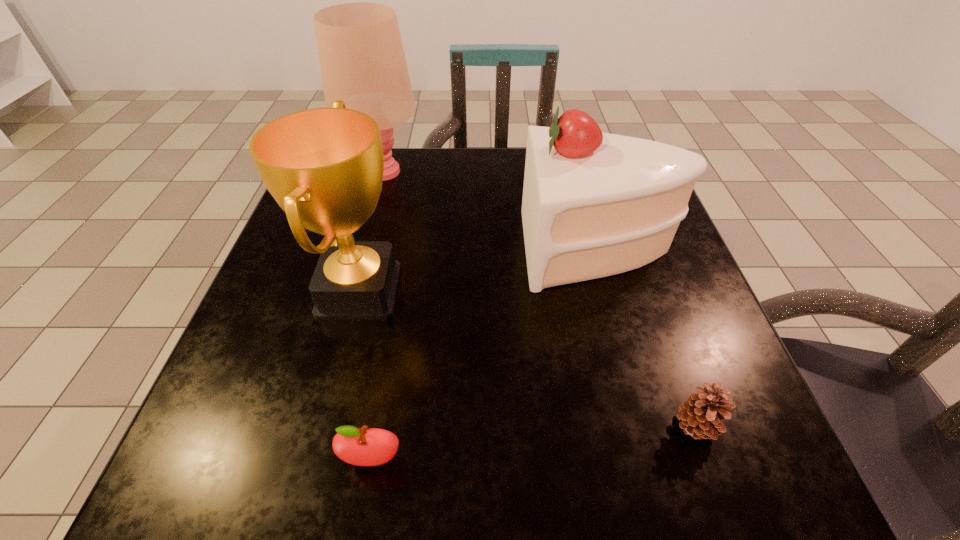
What are the coordinates of `free space at the near edge of the desktop` in the screenshot? It's located at (456, 438).

The image size is (960, 540). In order to click on vacant space at the left edge of the desktop in this screenshot , I will do `click(361, 228)`.

I want to click on vacant area at the right edge of the desktop, so click(750, 399).

At what (x,y) coordinates should I click in order to perform the action: click on blank region between the apple and the award. Please return your answer as a coordinate pair (x, y). Looking at the image, I should click on (366, 375).

This screenshot has width=960, height=540. Find the location of `vacant region between the cake and the pinecone`. vacant region between the cake and the pinecone is located at coordinates tap(647, 337).

This screenshot has height=540, width=960. Find the location of `vacant region between the award and the pinecone`. vacant region between the award and the pinecone is located at coordinates (528, 358).

I want to click on free space that is in between the award and the apple, so click(366, 375).

Identify the location of free space that is in between the cake and the apple. point(485,354).

Image resolution: width=960 pixels, height=540 pixels. I want to click on vacant space that is in between the lampshade and the pinecone, so click(540, 300).

Identify the location of free space between the pinecone and the cake. This screenshot has width=960, height=540. tap(647, 337).